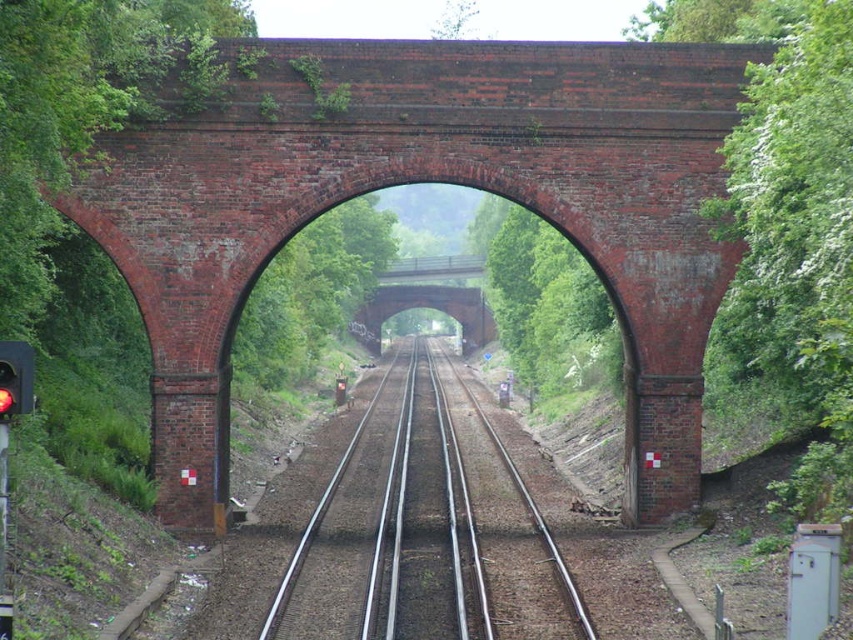
Who is higher up, metallic smooth train track at center or brick arch bridge at center?

brick arch bridge at center is higher up.

Can you confirm if metallic smooth train track at center is taller than brick arch bridge at center?

Incorrect, metallic smooth train track at center's height is not larger of brick arch bridge at center's.

In order to click on metallic smooth train track at center in this screenshot , I will do `click(426, 532)`.

The image size is (853, 640). I want to click on metallic smooth train track at center, so click(x=426, y=532).

Between brick arch bridge at center and red glass traffic light at left, which one is positioned lower?

red glass traffic light at left is lower down.

Is brick arch bridge at center shorter than red glass traffic light at left?

Incorrect, brick arch bridge at center's height does not fall short of red glass traffic light at left's.

Is point (431, 291) farther from camera compared to point (12, 397)?

Yes, point (431, 291) is farther from viewer.

Identify the location of brick arch bridge at center. (425, 307).

Who is positioned more to the right, red brick bridge at center or red glass traffic light at left?

red brick bridge at center is more to the right.

Between point (442, 54) and point (33, 397), which one is positioned in front?

Point (33, 397) is in front.

Where is `red brick bridge at center`? Image resolution: width=853 pixels, height=640 pixels. red brick bridge at center is located at coordinates (427, 180).